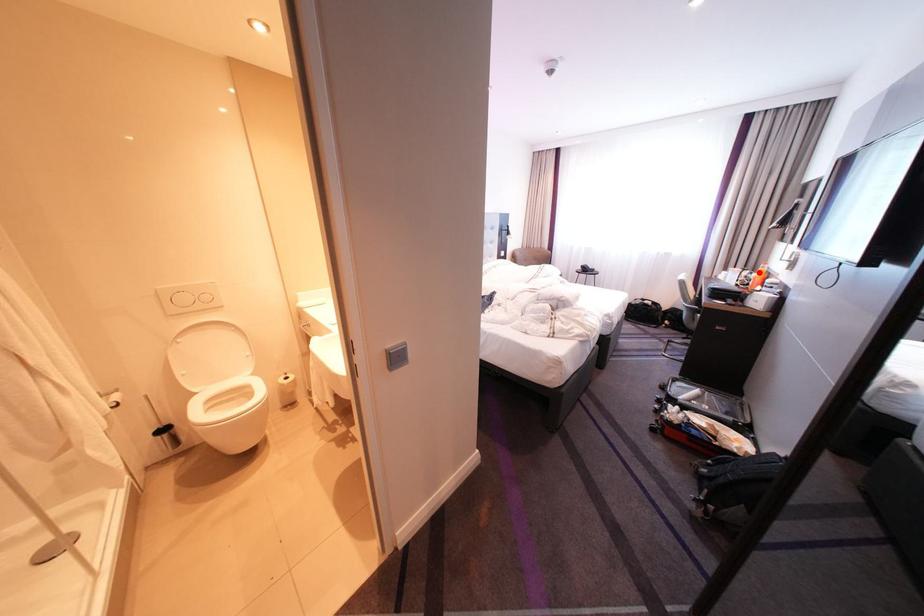
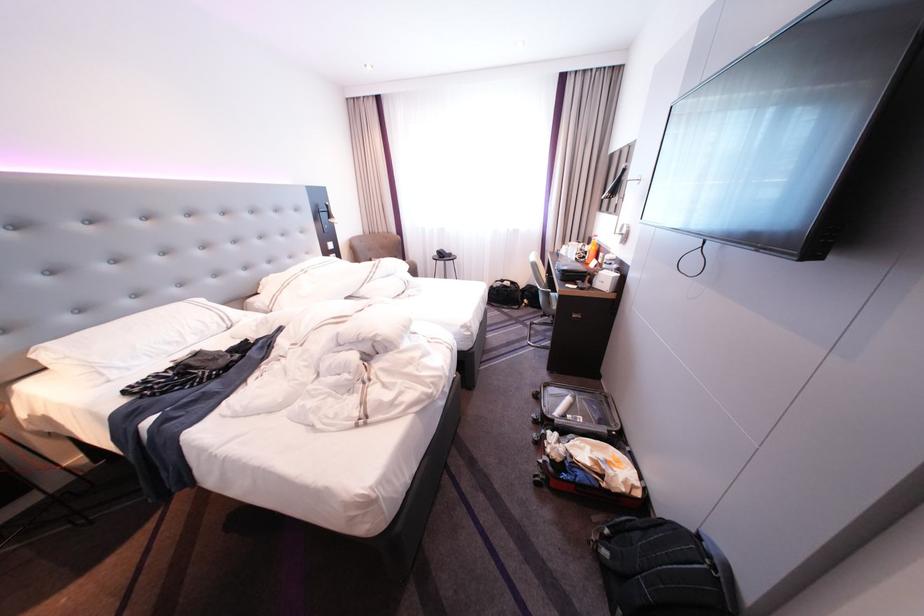
Where in the second image is the point corresponding to the highlighted location from the first image?

(593, 245)